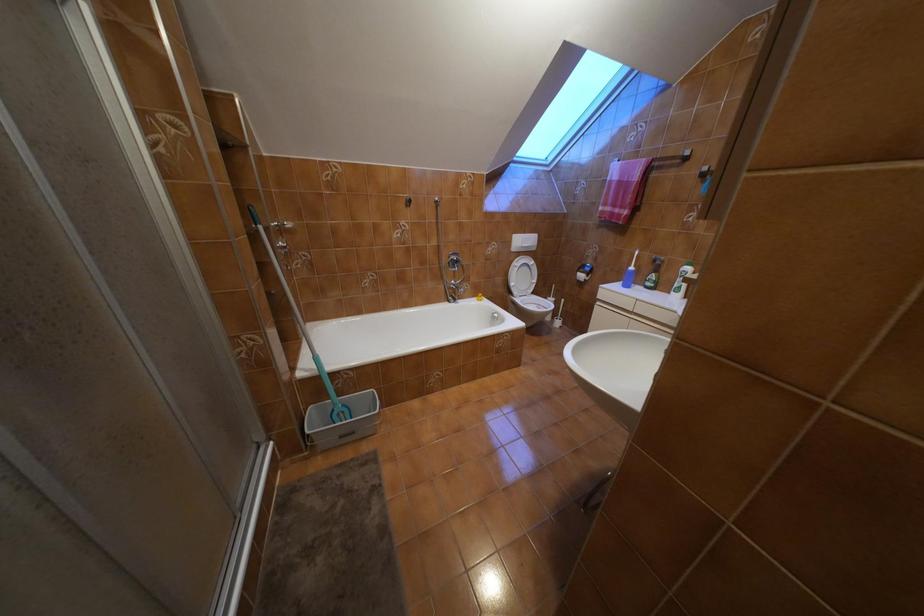
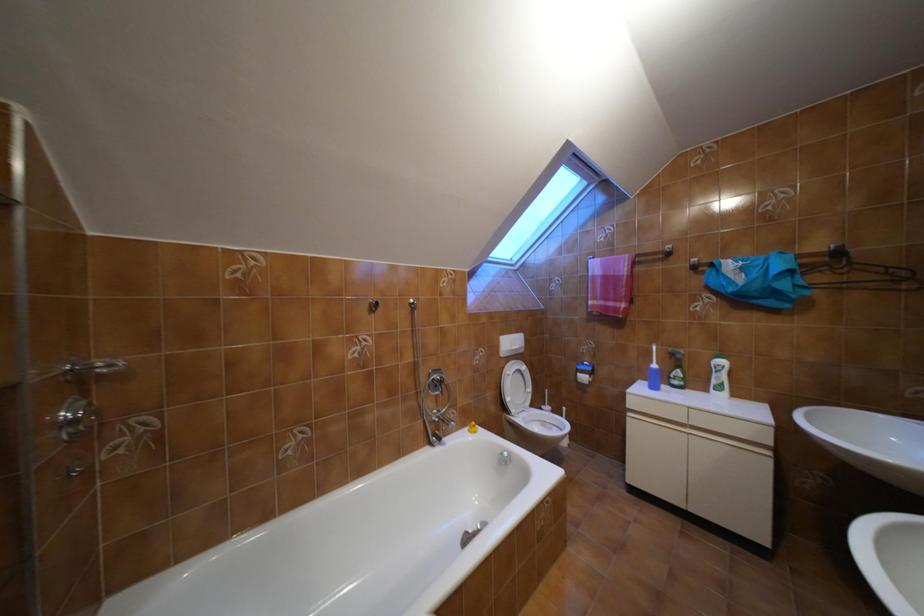
In a continuous first-person perspective shot, in which direction is the camera moving?

The movement direction of the cameraman is left, forward.